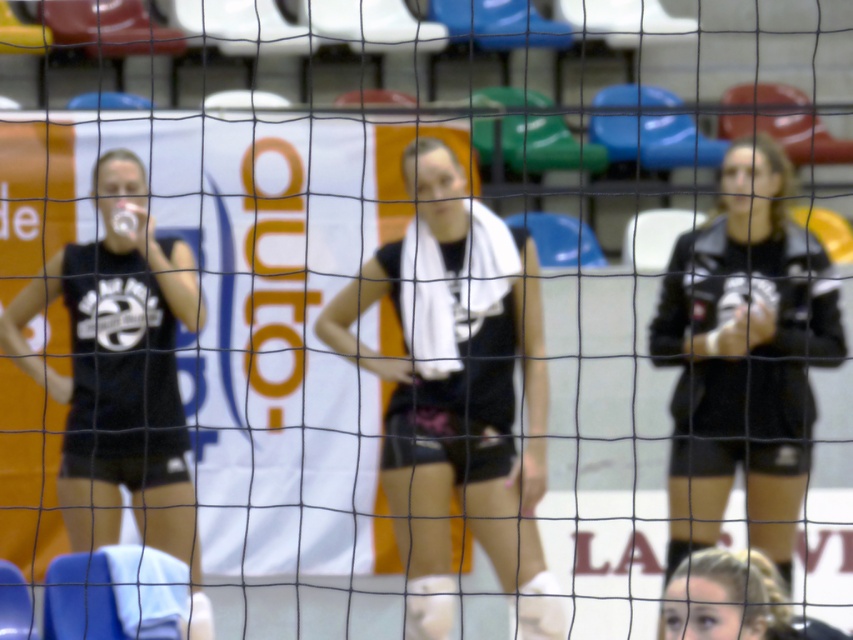
Is black matte tank top at center smaller than black matte tank top at left?

Yes, black matte tank top at center is smaller than black matte tank top at left.

In the scene shown: Between black matte tank top at center and black matte tank top at left, which one appears on the left side from the viewer's perspective?

black matte tank top at left

Is point (467, 440) behind point (55, 291)?

No.

Identify the location of black matte tank top at center. The height and width of the screenshot is (640, 853). [x=457, y=390].

Is point (494, 339) less distant than point (756, 416)?

Yes, point (494, 339) is in front of point (756, 416).

This screenshot has width=853, height=640. Identify the location of black matte tank top at center. (457, 390).

The height and width of the screenshot is (640, 853). What are the coordinates of `black matte tank top at center` in the screenshot? It's located at (457, 390).

Does black matte jacket at right have a greater width compared to black matte tank top at left?

No.

Who is more distant from viewer, (788, 353) or (194, 264)?

Positioned behind is point (194, 264).

Where is `black matte jacket at right`? black matte jacket at right is located at coordinates 744,356.